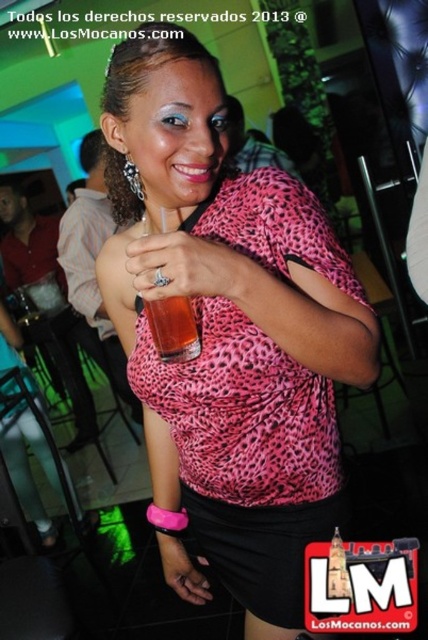
Between pink leopard print blouse at center and translucent plastic cup at center, which one appears on the right side from the viewer's perspective?

pink leopard print blouse at center

How distant is pink leopard print blouse at center from translucent plastic cup at center?

9.67 inches

Between point (199, 145) and point (178, 337), which one is positioned behind?

Point (178, 337)

What are the coordinates of `pink leopard print blouse at center` in the screenshot? It's located at (228, 332).